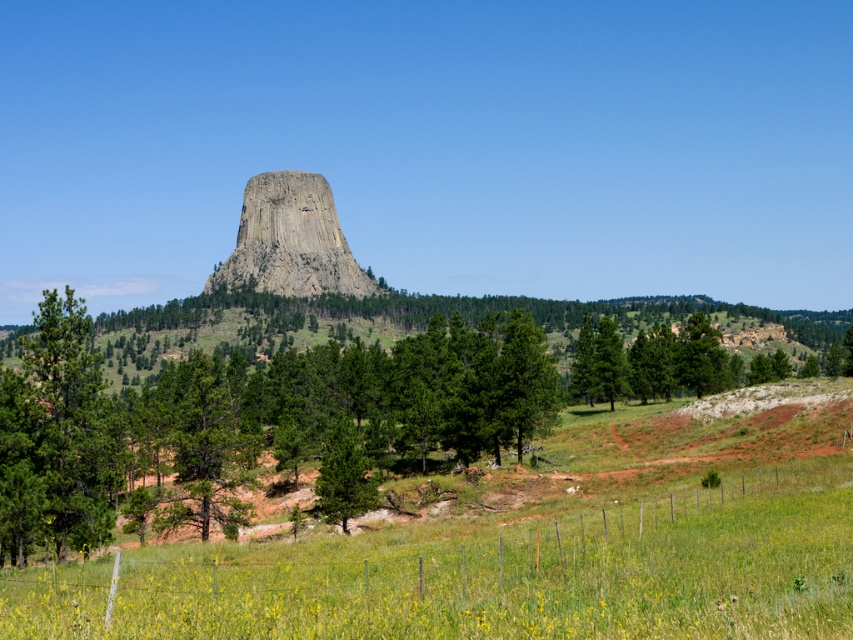
You are standing at the camera position and want to take a photo of the green matte tree at left. If you walk straight towards the tree for 200 feet, will you be able to reach it?

The green matte tree at left and camera are 231.66 feet apart. After walking 200 feet towards it, you would still be 31.66 feet away from the green matte tree at left, so you won not reach it.

You are standing at the base of the volcanic rock formation in the image and notice a green matte tree. Based on its position at point (56, 436), would this tree be to your left or right side?

The green matte tree at left is located at point (56, 436), which is to the left side from your perspective at the base of the volcanic rock formation.

You are planning to set up a picnic area near the green matte tree at left and the green rough bark tree at center. Which tree would provide more shade given their sizes?

The green matte tree at left would provide more shade because it has a larger size compared to the green rough bark tree at center.